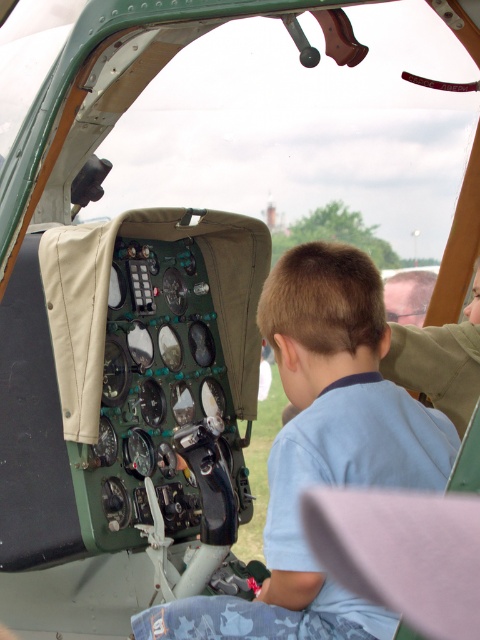
You are a flight attendant on a small aircraft and need to reach an emergency lever located at the central control panel. The lever is between the light blue shirt at center and the light brown leather hand at upper right. Can you determine if the space between them is sufficient to access the lever, considering the lever requires 36 inches of clearance?

The distance between the light blue shirt at center and the light brown leather hand at upper right is 37.12 inches, which is more than the required 36 inches of clearance. Therefore, the space is sufficient to access the lever.

You are a passenger in the aircraft cockpit and need to reach the control panel. There is a light blue shirt at center and a light brown leather hand at upper right in your view. Which object is closer to the control panel?

The light blue shirt at center is closer to the control panel because it is located below the light brown leather hand at upper right, placing it lower and nearer to the panel.

You are a flight attendant checking the cockpit for safety. You notice the light blue shirt at center and the light brown leather hand at upper right. Which object takes up more space in the cockpit?

The light blue shirt at center is larger in size than the light brown leather hand at upper right, so it takes up more space in the cockpit.